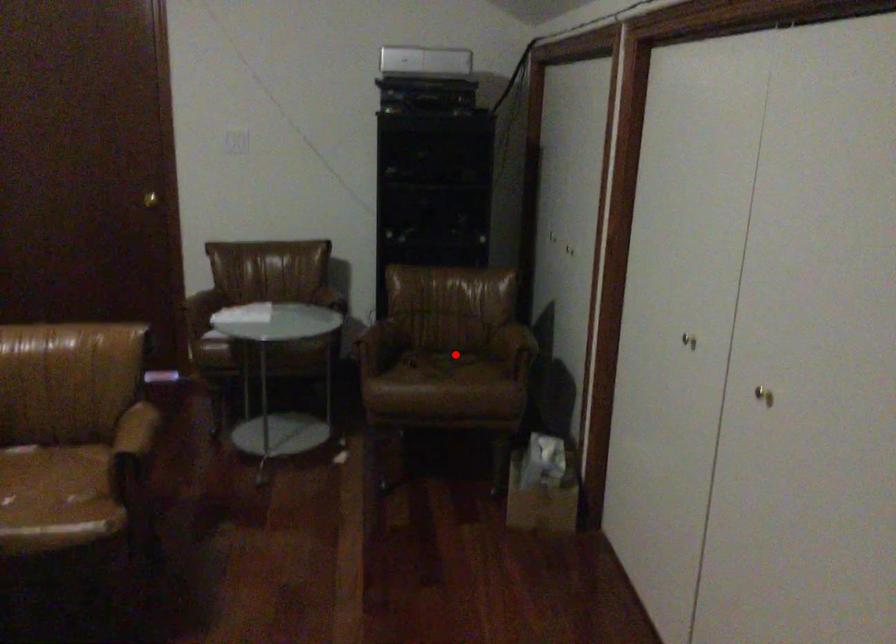
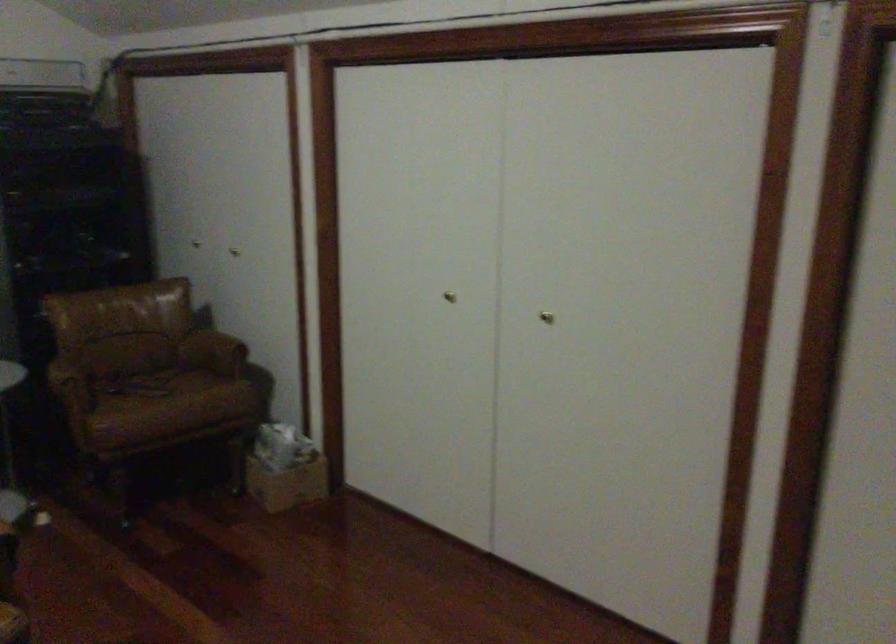
Locate, in the second image, the point that corresponds to the highlighted location in the first image.

(149, 370)